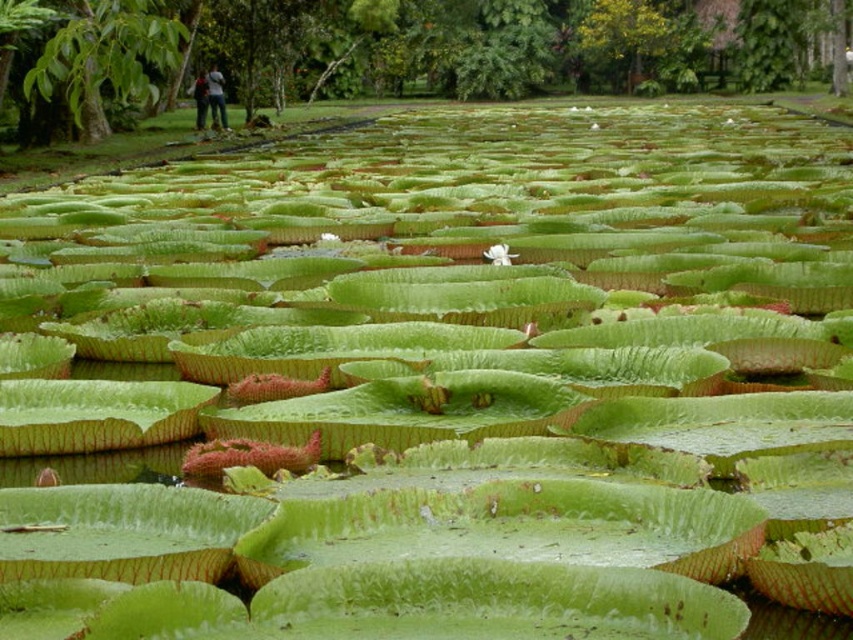
You are an observer looking at the pond with water lilies. You notice a denim jacket at upper left and a white matte flower at center. Which object is positioned higher in the image?

The denim jacket at upper left is positioned higher in the image than the white matte flower at center.

You are an observer standing at the edge of the pond. You notice the dark blue jeans at upper left and the white matte flower at center. Which object is wider when viewed from your position?

The dark blue jeans at upper left is wider than the white matte flower at center.